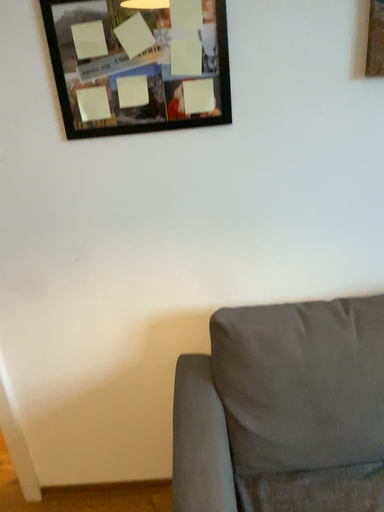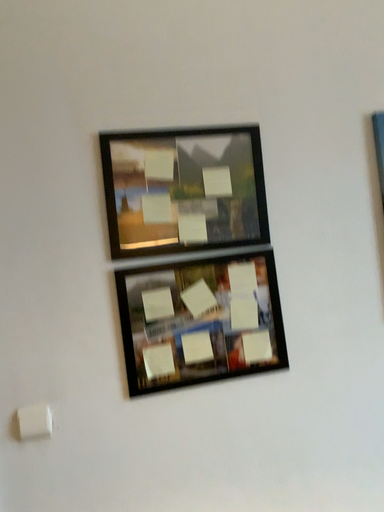
Question: How did the camera likely rotate when shooting the video?

Choices:
 (A) rotated downward
 (B) rotated upward

Answer: (B)